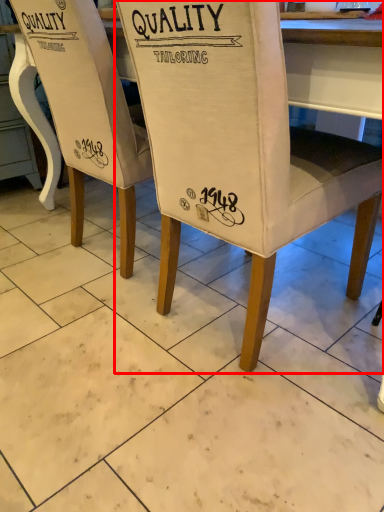
Question: Observing the image, what is the correct spatial positioning of chair (annotated by the red box) in reference to chair?

Choices:
 (A) right
 (B) left

Answer: (A)